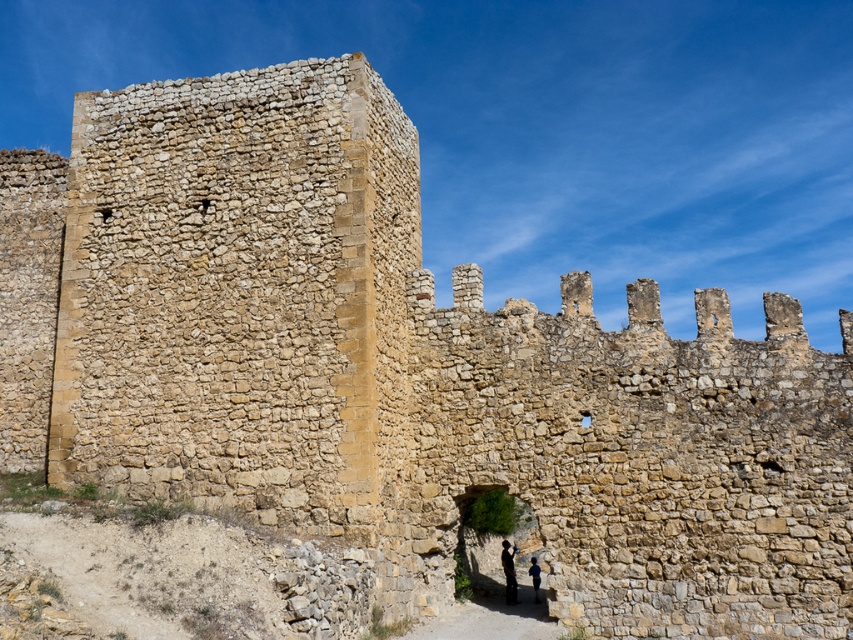
You are an archer positioned on the medieval stone wall and need to secure two flags, the dark blue fabric at center and the blue fabric at lower center. Which flag should you lower first if you need to retrieve them both and start from the ground?

You should lower the dark blue fabric at center first because it is above the blue fabric at lower center, so you can reach it by climbing up from the ground to the higher position before descending to retrieve the lower one.

You are a knight standing in front of the medieval stone wall. You see the dark blue fabric at center and the blue fabric at lower center. Which fabric is bigger in size?

The dark blue fabric at center is larger in size compared to the blue fabric at lower center.

You are an archer positioned on the medieval stone wall. You notice two pieces of fabric hanging from the wall. One is the dark blue fabric at center and the other is the blue fabric at lower center. Which fabric is closer to your left side?

The dark blue fabric at center is closer to your left side because it is positioned to the left of the blue fabric at lower center.